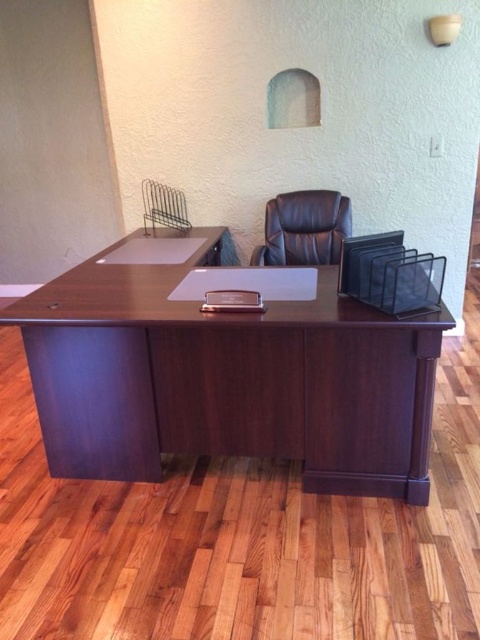
Question: Is leather at center further to camera compared to white matte lampshade at upper center?

Choices:
 (A) yes
 (B) no

Answer: (A)

Question: Which object appears farthest from the camera in this image?

Choices:
 (A) dark wood computer desk at center
 (B) leather at center
 (C) white matte lampshade at upper center

Answer: (B)

Question: Is dark wood computer desk at center thinner than leather at center?

Choices:
 (A) no
 (B) yes

Answer: (A)

Question: Which of these objects is positioned closest to the dark wood computer desk at center?

Choices:
 (A) white matte lampshade at upper center
 (B) leather at center

Answer: (B)

Question: Does leather at center have a greater width compared to white matte lampshade at upper center?

Choices:
 (A) no
 (B) yes

Answer: (B)

Question: Which point appears farthest from the camera in this image?

Choices:
 (A) (132, 422)
 (B) (454, 35)

Answer: (B)